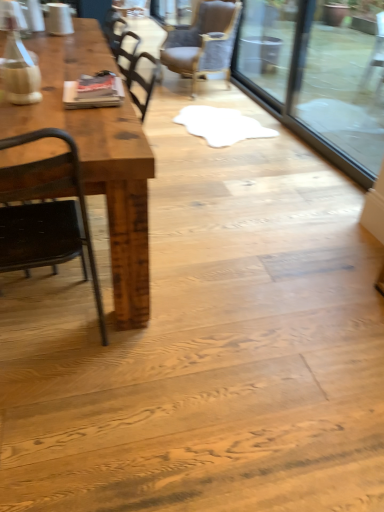
Question: Is rustic wood table at left positioned beyond the bounds of black metal chair at left, the second chair viewed from the back?

Choices:
 (A) yes
 (B) no

Answer: (A)

Question: From the image's perspective, is rustic wood table at left below black metal chair at left, which ranks as the 2th chair in right-to-left order?

Choices:
 (A) no
 (B) yes

Answer: (A)

Question: Considering the relative positions of rustic wood table at left and black metal chair at left, which ranks as the 2th chair in right-to-left order, in the image provided, is rustic wood table at left in front of black metal chair at left, which ranks as the 2th chair in right-to-left order,?

Choices:
 (A) no
 (B) yes

Answer: (A)

Question: Are rustic wood table at left and black metal chair at left, the 1th chair viewed from the left, beside each other?

Choices:
 (A) yes
 (B) no

Answer: (B)

Question: Is rustic wood table at left shorter than black metal chair at left, which ranks as the 2th chair in right-to-left order?

Choices:
 (A) no
 (B) yes

Answer: (B)

Question: Can you confirm if rustic wood table at left is positioned to the right of black metal chair at left, the second chair viewed from the back?

Choices:
 (A) no
 (B) yes

Answer: (A)

Question: Can you confirm if transparent glass door at upper right is thinner than black metal chair at left, the 1th chair viewed from the left?

Choices:
 (A) no
 (B) yes

Answer: (B)

Question: Is transparent glass door at upper right completely or partially outside of black metal chair at left, the second chair viewed from the back?

Choices:
 (A) yes
 (B) no

Answer: (A)

Question: Is the depth of transparent glass door at upper right less than that of black metal chair at left, the second chair viewed from the back?

Choices:
 (A) yes
 (B) no

Answer: (B)

Question: Is transparent glass door at upper right far away from black metal chair at left, the first chair when ordered from front to back?

Choices:
 (A) no
 (B) yes

Answer: (B)

Question: Is transparent glass door at upper right taller than black metal chair at left, which ranks as the 2th chair in right-to-left order?

Choices:
 (A) no
 (B) yes

Answer: (B)

Question: Is transparent glass door at upper right surrounding black metal chair at left, the second chair viewed from the back?

Choices:
 (A) no
 (B) yes

Answer: (A)

Question: Is transparent glass door at upper right positioned behind rustic wood table at left?

Choices:
 (A) no
 (B) yes

Answer: (B)